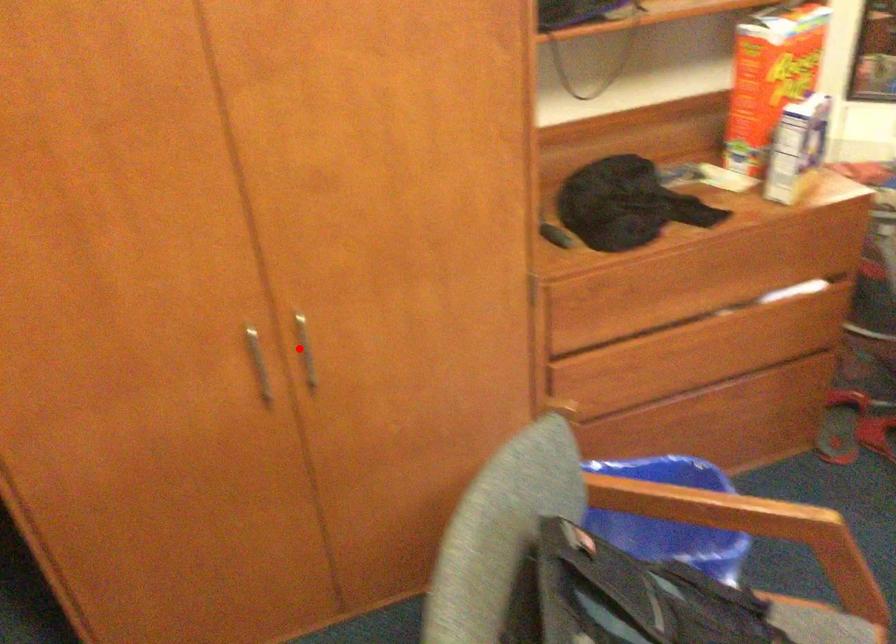
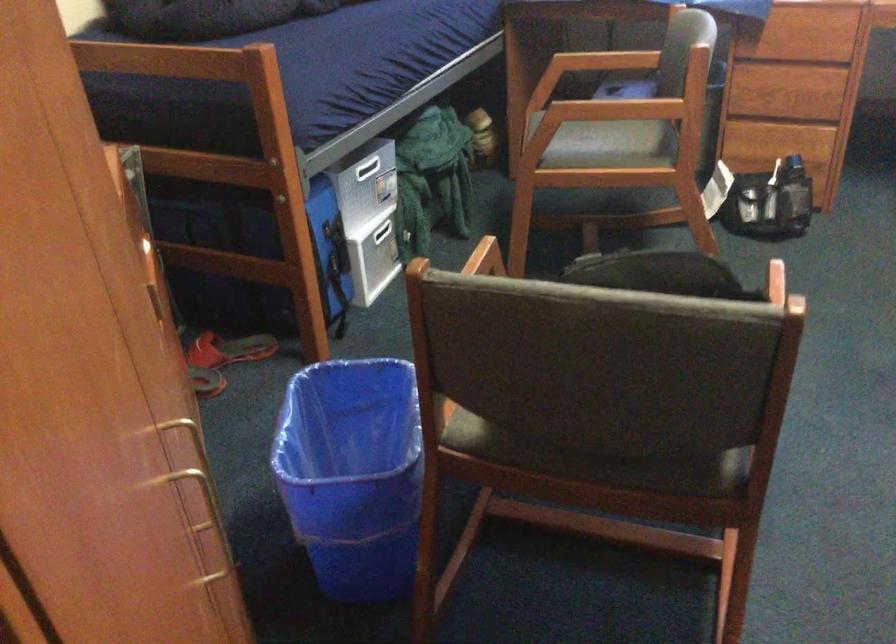
The point at the highlighted location is marked in the first image. Where is the corresponding point in the second image?

(188, 419)